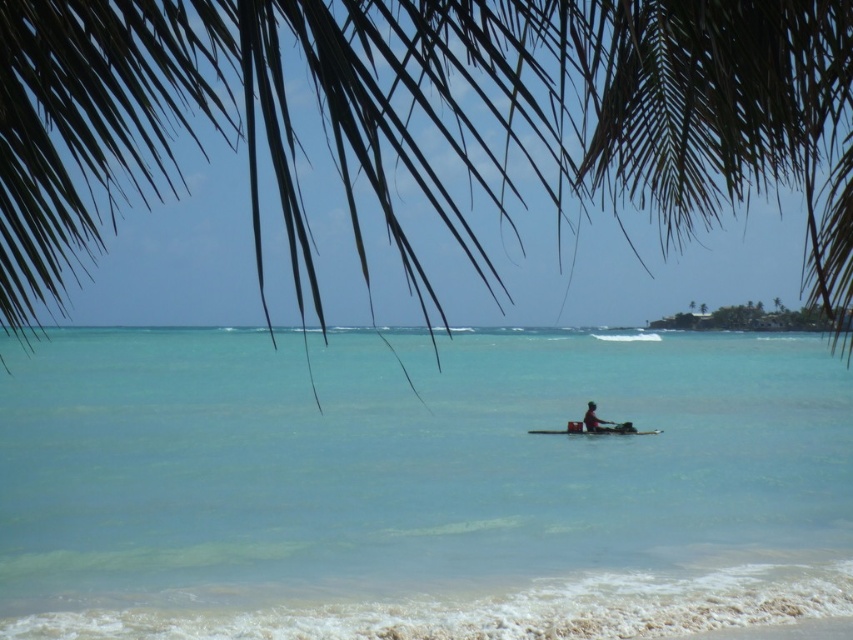
Looking at this image, you are standing on the beach and looking through the palm tree fronds. There are two points marked in the image. Which point is closer to you, point [76,472] or point [584,116]?

Point [76,472] is closer to you because it is further to the camera than point [584,116].

You are standing on the beach and want to take a photo of both the green leafy palm tree at upper center and the wooden boat at center. Which object should you zoom in on to ensure both fit in the frame?

You should zoom in on the wooden boat at center because the green leafy palm tree at upper center is wider than the wooden boat at center, so zooming in on the narrower object allows both to fit within the frame.